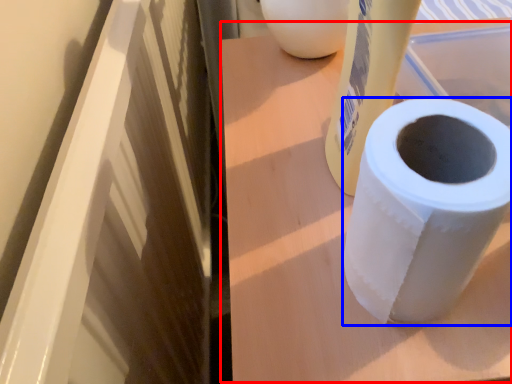
Question: Which object appears farthest to the camera in this image, table (highlighted by a red box) or toilet paper (highlighted by a blue box)?

Choices:
 (A) table
 (B) toilet paper

Answer: (A)